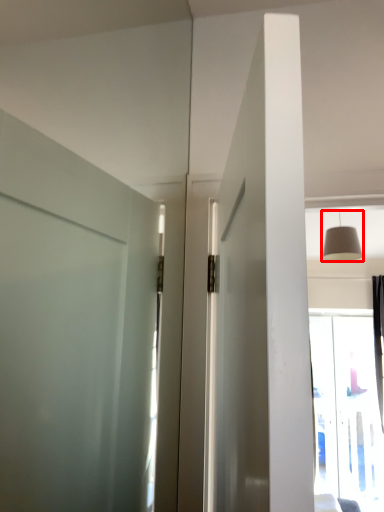
Question: From the image's perspective, what is the correct spatial relationship of light fixture (annotated by the red box) in relation to window?

Choices:
 (A) below
 (B) above

Answer: (B)